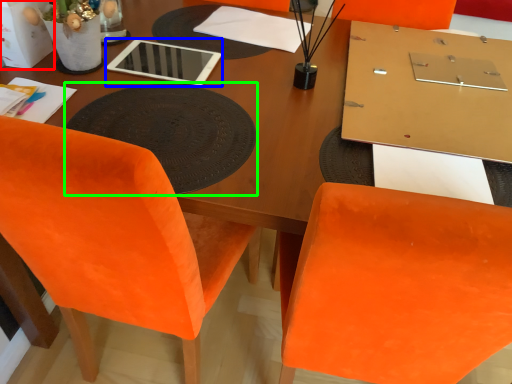
Question: Which object is positioned farthest from box (highlighted by a red box)? Select from tablet computer (highlighted by a blue box) and mat (highlighted by a green box).

Choices:
 (A) tablet computer
 (B) mat

Answer: (B)